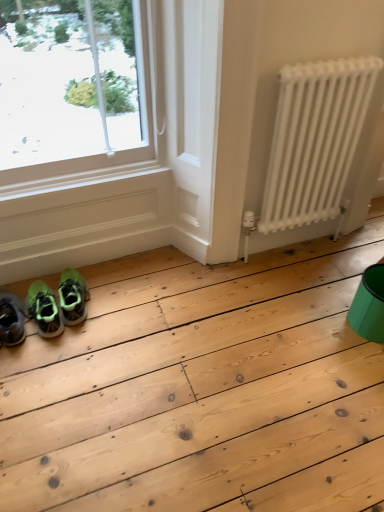
Question: From a real-world perspective, is green matte sneakers at lower left under green matte sneakers at lower left?

Choices:
 (A) yes
 (B) no

Answer: (B)

Question: From the image's perspective, would you say green matte sneakers at lower left is shown under green matte sneakers at lower left?

Choices:
 (A) yes
 (B) no

Answer: (B)

Question: Would you say green matte sneakers at lower left is part of green matte sneakers at lower left's contents?

Choices:
 (A) yes
 (B) no

Answer: (B)

Question: Can you confirm if green matte sneakers at lower left is shorter than green matte sneakers at lower left?

Choices:
 (A) yes
 (B) no

Answer: (A)

Question: Is green matte sneakers at lower left at the left side of green matte sneakers at lower left?

Choices:
 (A) yes
 (B) no

Answer: (B)

Question: Is green matte sneakers at lower left positioned behind green matte sneakers at lower left?

Choices:
 (A) no
 (B) yes

Answer: (B)

Question: Can you confirm if green matte sneakers at lower left is bigger than green matte sneakers at lower left?

Choices:
 (A) no
 (B) yes

Answer: (B)

Question: From the image's perspective, would you say green matte sneakers at lower left is positioned over green matte sneakers at lower left?

Choices:
 (A) yes
 (B) no

Answer: (B)

Question: Are green matte sneakers at lower left and green matte sneakers at lower left located far from each other?

Choices:
 (A) yes
 (B) no

Answer: (B)

Question: Is green matte sneakers at lower left completely or partially inside green matte sneakers at lower left?

Choices:
 (A) yes
 (B) no

Answer: (B)

Question: From the image's perspective, is green matte sneakers at lower left located beneath green matte sneakers at lower left?

Choices:
 (A) yes
 (B) no

Answer: (A)

Question: Is the position of green matte sneakers at lower left more distant than that of green matte sneakers at lower left?

Choices:
 (A) no
 (B) yes

Answer: (A)

Question: Is teal plastic bucket at lower right taller than white matte radiator at right?

Choices:
 (A) no
 (B) yes

Answer: (A)